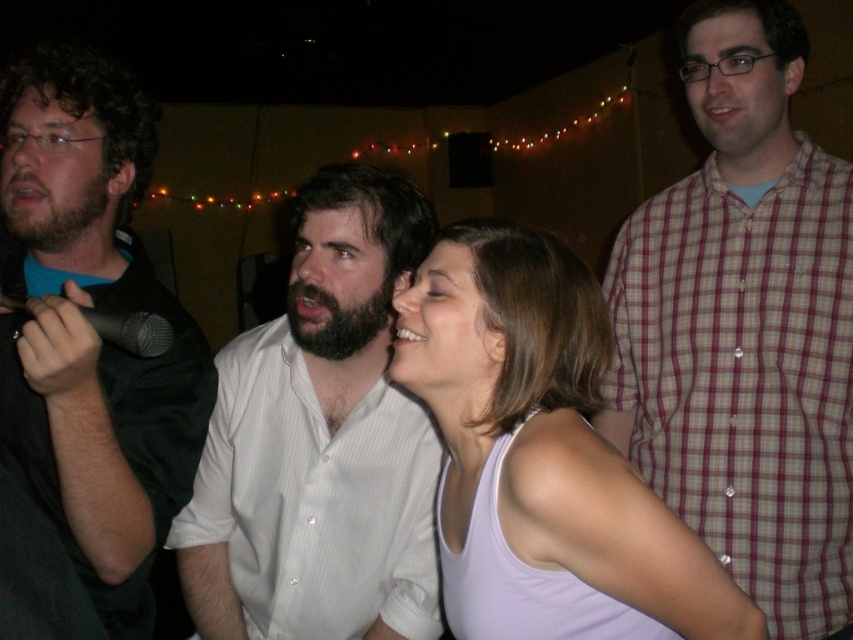
Does point (833, 413) come closer to viewer compared to point (622, 630)?

No, (833, 413) is further to viewer.

Is plaid shirt at right further to camera compared to white tank top at center?

Yes, it is.

Is point (787, 113) more distant than point (727, 628)?

Yes, point (787, 113) is behind point (727, 628).

This screenshot has width=853, height=640. Find the location of `plaid shirt at right`. plaid shirt at right is located at coordinates (746, 326).

Between white striped shirt at center and white tank top at center, which one appears on the left side from the viewer's perspective?

white striped shirt at center is more to the left.

What do you see at coordinates (320, 440) in the screenshot?
I see `white striped shirt at center` at bounding box center [320, 440].

Is point (355, 544) more distant than point (622, 536)?

Yes, it is behind point (622, 536).

This screenshot has height=640, width=853. Find the location of `white striped shirt at center`. white striped shirt at center is located at coordinates (320, 440).

In the scene shown: Does white striped shirt at center appear under black metallic microphone at left?

Indeed, white striped shirt at center is positioned under black metallic microphone at left.

Based on the photo, can you confirm if white striped shirt at center is positioned to the left of black metallic microphone at left?

No, white striped shirt at center is not to the left of black metallic microphone at left.

Between point (438, 618) and point (135, 321), which one is positioned behind?

The point (438, 618) is more distant.

Image resolution: width=853 pixels, height=640 pixels. I want to click on white striped shirt at center, so click(x=320, y=440).